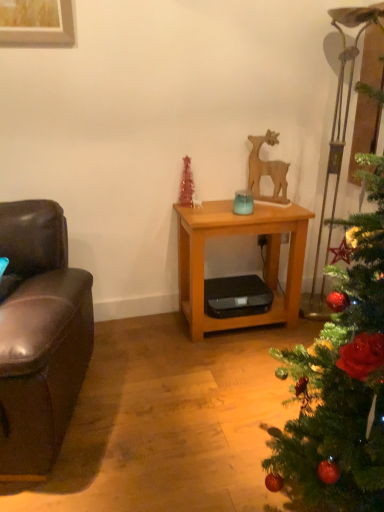
Identify the location of vacant space situated on the left part of wooden table at center. This screenshot has height=512, width=384. (140, 346).